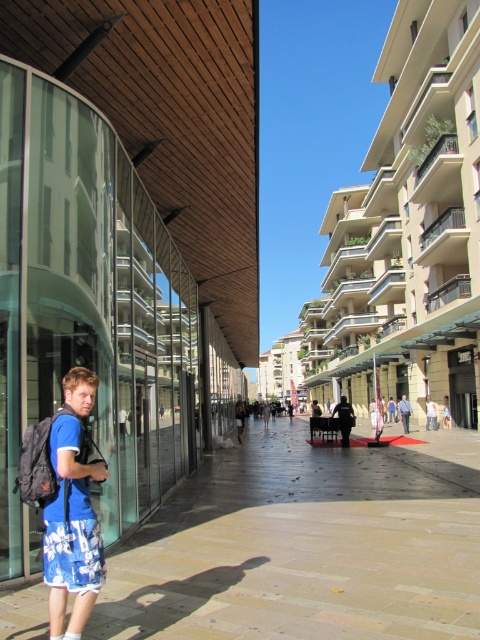
Is brown stone pavement at lower center bigger than blue fabric shorts at lower left?

Indeed, brown stone pavement at lower center has a larger size compared to blue fabric shorts at lower left.

This screenshot has height=640, width=480. Describe the element at coordinates (307, 545) in the screenshot. I see `brown stone pavement at lower center` at that location.

The image size is (480, 640). Find the location of `brown stone pavement at lower center`. brown stone pavement at lower center is located at coordinates point(307,545).

Can you confirm if blue printed shorts at lower left is positioned to the left of blue fabric shirt at center?

Indeed, blue printed shorts at lower left is positioned on the left side of blue fabric shirt at center.

Find the location of a particular element. This screenshot has width=480, height=640. blue printed shorts at lower left is located at coordinates (72, 513).

This screenshot has height=640, width=480. Describe the element at coordinates (72, 513) in the screenshot. I see `blue printed shorts at lower left` at that location.

Find the location of a particular element. This screenshot has width=480, height=640. blue printed shorts at lower left is located at coordinates (72, 513).

Is point (50, 548) positioned in front of point (348, 436)?

Yes.

Find the location of `blue printed shorts at lower left`. blue printed shorts at lower left is located at coordinates (72, 513).